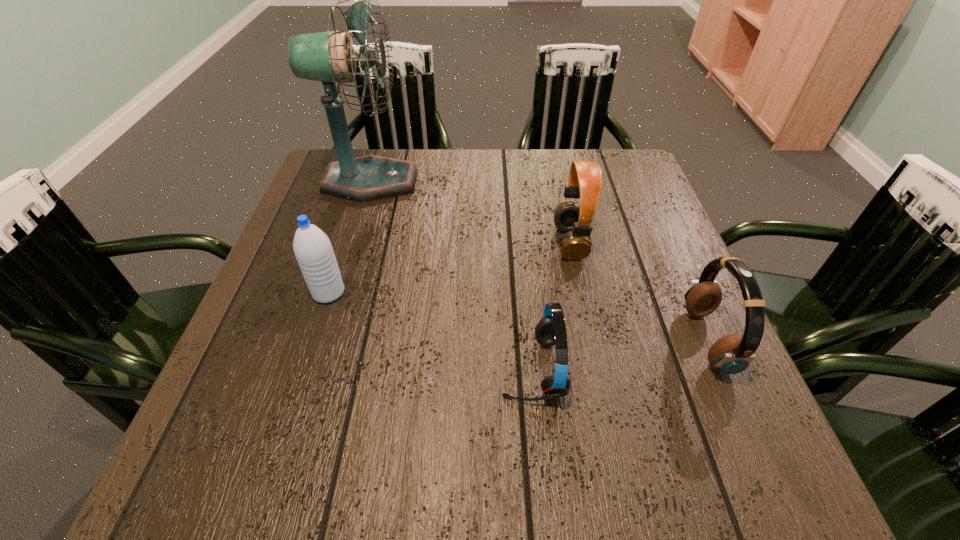
Locate an element on the screen. Image resolution: width=960 pixels, height=540 pixels. free space located on the ear cups of the fourth object from left to right is located at coordinates (407, 242).

I want to click on free space located on the ear cups of the fourth object from left to right, so click(476, 242).

Find the location of a particular element. The height and width of the screenshot is (540, 960). free space located on the front of the water bottle is located at coordinates (296, 395).

At what (x,y) coordinates should I click in order to perform the action: click on vacant space situated on the ear cup of the rightmost headset. Please return your answer as a coordinate pair (x, y). Image resolution: width=960 pixels, height=540 pixels. Looking at the image, I should click on (525, 340).

Identify the location of free region located on the ear cup of the rightmost headset. (558, 340).

At what (x,y) coordinates should I click in order to perform the action: click on vacant space situated on the ear cup of the rightmost headset. Please return your answer as a coordinate pair (x, y). Looking at the image, I should click on (664, 340).

Where is `free region located 0.130m with the microphone attached to the side of the leftmost headset`? free region located 0.130m with the microphone attached to the side of the leftmost headset is located at coordinates (428, 368).

Where is `free space located 0.320m with the microphone attached to the side of the leftmost headset`? free space located 0.320m with the microphone attached to the side of the leftmost headset is located at coordinates (322, 368).

You are a GUI agent. You are given a task and a screenshot of the screen. Output one action in this format:
    pyautogui.click(x=<x>, y=<y>)
    Task: Click on the vacant point located 0.210m with the microphone attached to the side of the leftmost headset
    
    Given the screenshot: What is the action you would take?
    pyautogui.click(x=383, y=368)

Where is `object present at the far edge`? The image size is (960, 540). object present at the far edge is located at coordinates (329, 57).